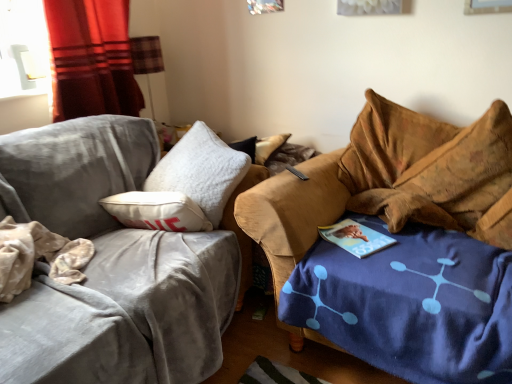
This screenshot has height=384, width=512. In order to click on red fabric curtain at left in this screenshot , I will do `click(91, 59)`.

The height and width of the screenshot is (384, 512). What are the coordinates of `velvet brown couch at right, the first studio couch in the right-to-left sequence` in the screenshot? It's located at (390, 183).

Is red fabric curtain at left taller than brown velvety bean bag chair at right?

No, red fabric curtain at left is not taller than brown velvety bean bag chair at right.

From the image's perspective, is red fabric curtain at left above brown velvety bean bag chair at right?

Yes.

Would you say red fabric curtain at left is inside or outside brown velvety bean bag chair at right?

red fabric curtain at left is located beyond the bounds of brown velvety bean bag chair at right.

From the image's perspective, is velvet gray couch at left, which is the second studio couch in right-to-left order, above brown velvety bean bag chair at right?

No.

From a real-world perspective, is velvet gray couch at left, the 1th studio couch when ordered from left to right, located beneath brown velvety bean bag chair at right?

Yes, from a real-world perspective, velvet gray couch at left, the 1th studio couch when ordered from left to right, is below brown velvety bean bag chair at right.

Is brown velvety bean bag chair at right at the back of velvet gray couch at left, the 1th studio couch when ordered from left to right?

That's not correct — velvet gray couch at left, the 1th studio couch when ordered from left to right, is not looking away from brown velvety bean bag chair at right.

Does point (88, 161) come farther from viewer compared to point (377, 148)?

No, it is not.

From a real-world perspective, who is located higher, velvet gray couch at left, the 1th studio couch when ordered from left to right, or velvet brown couch at right, which is counted as the 2th studio couch, starting from the left?

From a 3D spatial view, velvet gray couch at left, the 1th studio couch when ordered from left to right, is above.

Is velvet gray couch at left, which is the second studio couch in right-to-left order, not inside velvet brown couch at right, which is counted as the 2th studio couch, starting from the left?

Yes.

Is velvet gray couch at left, the 1th studio couch when ordered from left to right, turned away from velvet brown couch at right, the first studio couch in the right-to-left sequence?

velvet gray couch at left, the 1th studio couch when ordered from left to right, is not turned away from velvet brown couch at right, the first studio couch in the right-to-left sequence.

Find the location of a particular element. studio couch lying in front of the velvet brown couch at right, which is counted as the 2th studio couch, starting from the left is located at coordinates (110, 266).

Does point (92, 171) come behind point (153, 65)?

No, it is not.

Between velvet gray couch at left, which is the second studio couch in right-to-left order, and plaid fabric lampshade at upper left, which one has smaller size?

With smaller size is plaid fabric lampshade at upper left.

Is plaid fabric lampshade at upper left completely or partially inside velvet gray couch at left, which is the second studio couch in right-to-left order?

That's incorrect, plaid fabric lampshade at upper left is not inside velvet gray couch at left, which is the second studio couch in right-to-left order.

Which is behind, point (433, 152) or point (130, 101)?

The point (130, 101) is behind.

From the image's perspective, between brown velvety bean bag chair at right and red fabric curtain at left, which one is located above?

red fabric curtain at left, from the image's perspective.

From a real-world perspective, is brown velvety bean bag chair at right physically above red fabric curtain at left?

No, from a real-world perspective, brown velvety bean bag chair at right is not above red fabric curtain at left.

Does brown velvety bean bag chair at right lie in front of red fabric curtain at left?

That is True.

Choose the correct answer: Is velvet brown couch at right, the first studio couch in the right-to-left sequence, inside red fabric curtain at left or outside it?

velvet brown couch at right, the first studio couch in the right-to-left sequence, is spatially situated outside red fabric curtain at left.

In terms of size, does velvet brown couch at right, which is counted as the 2th studio couch, starting from the left, appear bigger or smaller than red fabric curtain at left?

Considering their sizes, velvet brown couch at right, which is counted as the 2th studio couch, starting from the left, takes up more space than red fabric curtain at left.

Considering the sizes of objects velvet brown couch at right, the first studio couch in the right-to-left sequence, and red fabric curtain at left in the image provided, who is wider, velvet brown couch at right, the first studio couch in the right-to-left sequence, or red fabric curtain at left?

velvet brown couch at right, the first studio couch in the right-to-left sequence.

Which of these two, brown velvety bean bag chair at right or velvet gray couch at left, which is the second studio couch in right-to-left order, is thinner?

With smaller width is brown velvety bean bag chair at right.

Does point (431, 192) come closer to viewer compared to point (111, 365)?

No, (431, 192) is behind (111, 365).

Would you say brown velvety bean bag chair at right is a long distance from velvet gray couch at left, the 1th studio couch when ordered from left to right?

No, brown velvety bean bag chair at right is in close proximity to velvet gray couch at left, the 1th studio couch when ordered from left to right.

The image size is (512, 384). In order to click on bean bag chair that is on the right side of red fabric curtain at left in this screenshot , I will do tap(432, 170).

You are a GUI agent. You are given a task and a screenshot of the screen. Output one action in this format:
    pyautogui.click(x=<x>, y=<y>)
    Task: Click on the studio couch that is the 1st object directly below the brown velvety bean bag chair at right (from a real-world perspective)
    
    Given the screenshot: What is the action you would take?
    pyautogui.click(x=110, y=266)

Looking at the image, which one is located further to plaid fabric lampshade at upper left, velvet gray couch at left, which is the second studio couch in right-to-left order, or velvet brown couch at right, which is counted as the 2th studio couch, starting from the left?

velvet brown couch at right, which is counted as the 2th studio couch, starting from the left, lies further to plaid fabric lampshade at upper left than the other object.

Which object lies further to the anchor point red fabric curtain at left, plaid fabric lampshade at upper left or brown velvety bean bag chair at right?

brown velvety bean bag chair at right lies further to red fabric curtain at left than the other object.

Which object lies nearer to the anchor point red fabric curtain at left, velvet brown couch at right, which is counted as the 2th studio couch, starting from the left, or plaid fabric lampshade at upper left?

plaid fabric lampshade at upper left.

Consider the image. Estimate the real-world distances between objects in this image. Which object is closer to brown velvety bean bag chair at right, red fabric curtain at left or plaid fabric lampshade at upper left?

red fabric curtain at left is positioned closer to the anchor brown velvety bean bag chair at right.

Looking at the image, which one is located closer to plaid fabric lampshade at upper left, red fabric curtain at left or velvet gray couch at left, which is the second studio couch in right-to-left order?

red fabric curtain at left is closer to plaid fabric lampshade at upper left.

From the image, which object appears to be nearer to brown velvety bean bag chair at right, plaid fabric lampshade at upper left or velvet gray couch at left, which is the second studio couch in right-to-left order?

Among the two, velvet gray couch at left, which is the second studio couch in right-to-left order, is located nearer to brown velvety bean bag chair at right.

Which object lies nearer to the anchor point plaid fabric lampshade at upper left, brown velvety bean bag chair at right or velvet brown couch at right, the first studio couch in the right-to-left sequence?

Among the two, velvet brown couch at right, the first studio couch in the right-to-left sequence, is located nearer to plaid fabric lampshade at upper left.

In the scene shown: Estimate the real-world distances between objects in this image. Which object is closer to velvet brown couch at right, the first studio couch in the right-to-left sequence, red fabric curtain at left or plaid fabric lampshade at upper left?

red fabric curtain at left is positioned closer to the anchor velvet brown couch at right, the first studio couch in the right-to-left sequence.

Find the location of a particular element. studio couch between red fabric curtain at left and velvet brown couch at right, the first studio couch in the right-to-left sequence, from left to right is located at coordinates (110, 266).

Identify the location of lamp between red fabric curtain at left and brown velvety bean bag chair at right. (146, 59).

Locate an element on the screen. The height and width of the screenshot is (384, 512). studio couch located between velvet gray couch at left, the 1th studio couch when ordered from left to right, and plaid fabric lampshade at upper left in the depth direction is located at coordinates (390, 183).

I want to click on lamp located between red fabric curtain at left and velvet brown couch at right, which is counted as the 2th studio couch, starting from the left, in the left-right direction, so click(x=146, y=59).